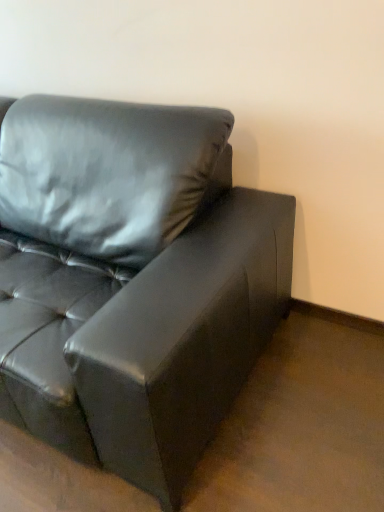
Question: Should I look upward or downward to see matte black couch at upper left?

Choices:
 (A) up
 (B) down

Answer: (A)